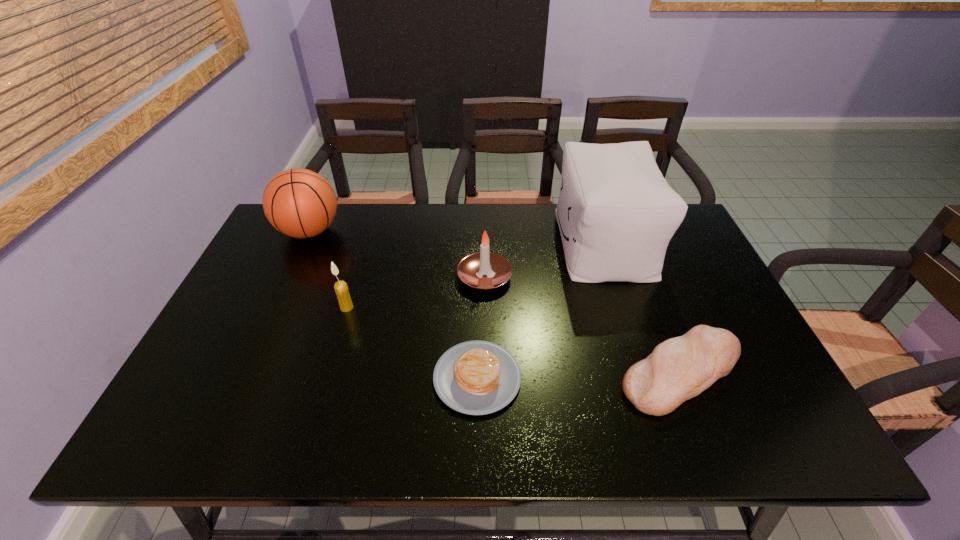
Find the location of a particular element. The height and width of the screenshot is (540, 960). object present at the left edge is located at coordinates (300, 203).

Image resolution: width=960 pixels, height=540 pixels. I want to click on cushion located at the right edge, so click(616, 213).

The height and width of the screenshot is (540, 960). I want to click on bread present at the right edge, so click(x=678, y=369).

You are a GUI agent. You are given a task and a screenshot of the screen. Output one action in this format:
    pyautogui.click(x=<x>, y=<y>)
    Task: Click on the object that is at the far left corner
    This screenshot has height=540, width=960.
    Given the screenshot: What is the action you would take?
    pyautogui.click(x=300, y=203)

Identify the location of object located at the far right corner. This screenshot has height=540, width=960. coord(616,213).

Find the location of a particular element. The image size is (960, 540). object positioned at the near right corner is located at coordinates (678, 369).

Locate an element on the screen. The width and height of the screenshot is (960, 540). vacant space at the far edge of the desktop is located at coordinates (353, 223).

This screenshot has width=960, height=540. In the image, there is a desktop. Find the location of `free space at the near edge`. free space at the near edge is located at coordinates (362, 413).

The image size is (960, 540). I want to click on vacant space at the left edge of the desktop, so click(x=241, y=343).

The image size is (960, 540). What are the coordinates of `blank space at the right edge` in the screenshot? It's located at (689, 302).